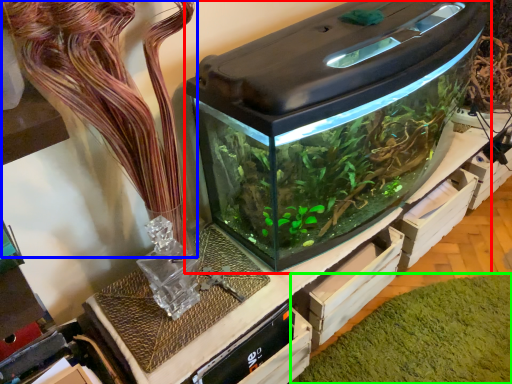
Question: Based on their relative distances, which object is farther from home appliance (highlighted by a red box)? Choose from plant (highlighted by a blue box) and algae (highlighted by a green box).

Choices:
 (A) plant
 (B) algae

Answer: (B)